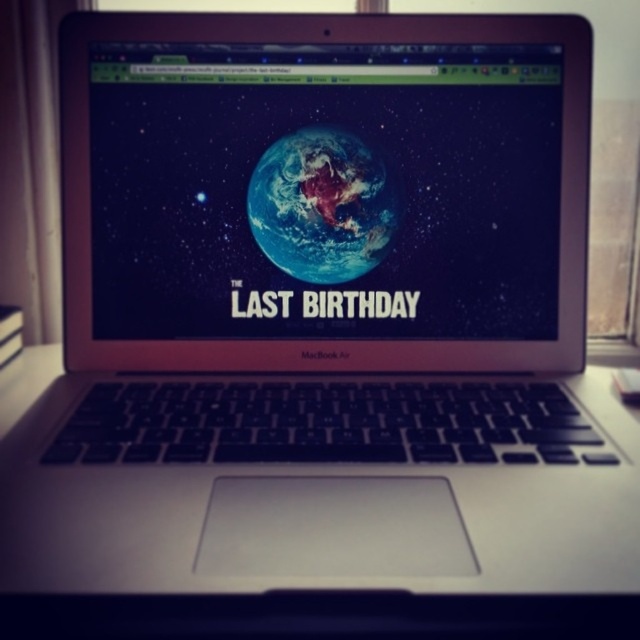
Question: Which point is closer to the camera taking this photo?

Choices:
 (A) (516, 129)
 (B) (301, 266)

Answer: (A)

Question: Does matte plastic screen at center lie behind earth-like planet at center?

Choices:
 (A) no
 (B) yes

Answer: (A)

Question: Is matte plastic screen at center positioned at the back of earth-like planet at center?

Choices:
 (A) yes
 (B) no

Answer: (B)

Question: Among these objects, which one is nearest to the camera?

Choices:
 (A) earth-like planet at center
 (B) matte plastic screen at center

Answer: (B)

Question: Which of the following is the closest to the observer?

Choices:
 (A) matte plastic screen at center
 (B) earth-like planet at center

Answer: (A)

Question: Does matte plastic screen at center appear under earth-like planet at center?

Choices:
 (A) no
 (B) yes

Answer: (A)